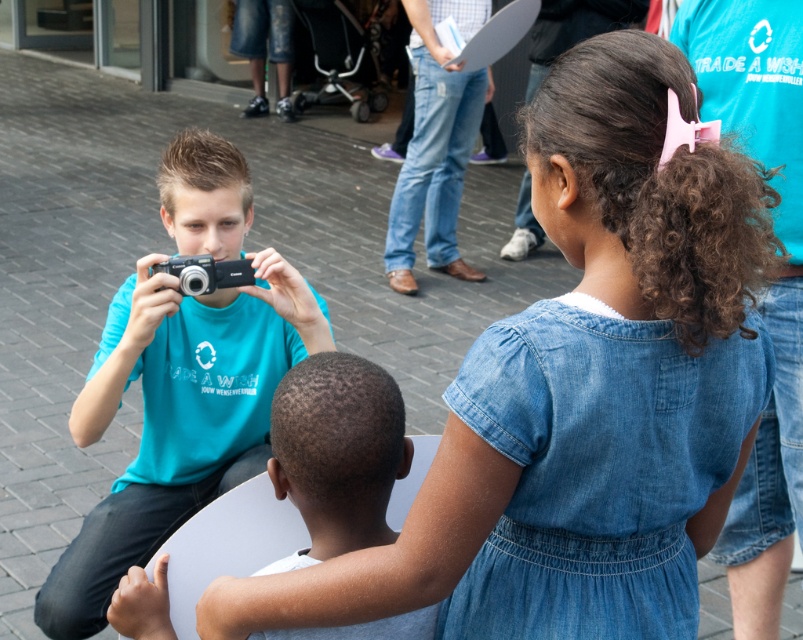
Does matte black camera at center have a greater width compared to blue jeans at center?

No, matte black camera at center is not wider than blue jeans at center.

Is point (308, 404) in front of point (446, 211)?

Yes, point (308, 404) is in front of point (446, 211).

This screenshot has width=803, height=640. I want to click on matte black camera at center, so point(337,452).

Does denim dress at center have a lesser width compared to matte black camera at left?

In fact, denim dress at center might be wider than matte black camera at left.

Between point (577, 209) and point (237, 449), which one is positioned in front?

Point (577, 209)

What do you see at coordinates (581, 392) in the screenshot?
I see `denim dress at center` at bounding box center [581, 392].

The width and height of the screenshot is (803, 640). I want to click on denim dress at center, so click(x=581, y=392).

Is denim dress at center shorter than matte black camera at center?

In fact, denim dress at center may be taller than matte black camera at center.

Between denim dress at center and matte black camera at center, which one appears on the left side from the viewer's perspective?

Positioned to the left is matte black camera at center.

Locate an element on the screen. denim dress at center is located at coordinates (581, 392).